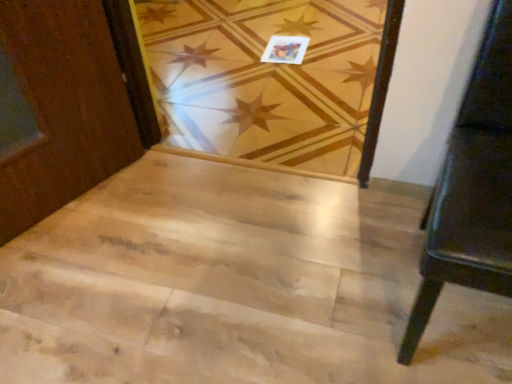
Question: Is black leather bench at right bigger or smaller than natural wood stairwell at center?

Choices:
 (A) small
 (B) big

Answer: (B)

Question: From a real-world perspective, is black leather bench at right positioned above or below natural wood stairwell at center?

Choices:
 (A) below
 (B) above

Answer: (B)

Question: Which object is positioned closest to the matte paper postcard at upper center?

Choices:
 (A) natural wood floor at center
 (B) black leather bench at right
 (C) natural wood stairwell at center

Answer: (A)

Question: Based on their relative distances, which object is nearer to the black leather bench at right?

Choices:
 (A) natural wood stairwell at center
 (B) matte paper postcard at upper center
 (C) natural wood floor at center

Answer: (A)